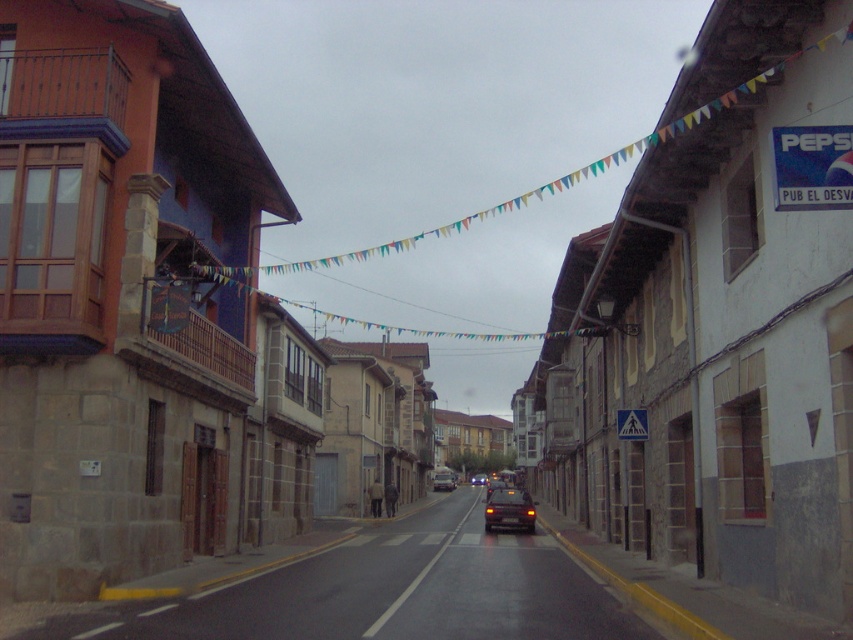
You are a delivery person trying to park your van in the street. You see the shiny dark red car at center and the metallic silver car at center. Which car is parked higher up on the street?

The shiny dark red car at center is above the metallic silver car at center, so it is parked higher up on the street.

You are a delivery drone flying over the narrow street. You need to land on the metallic silver car at center. What are the coordinates where you should aim to land?

The coordinates for the metallic silver car at center are at point [444,480]. You should aim for those coordinates to land safely.

You are a pedestrian waiting at the crosswalk on the right side of the street. You want to cross the street to the other side. The shiny dark red car at center and the metallic silver car at center are in your path. Which car should you be cautious of first?

You should be cautious of the shiny dark red car at center first because it is in front of the metallic silver car at center and closer to you.